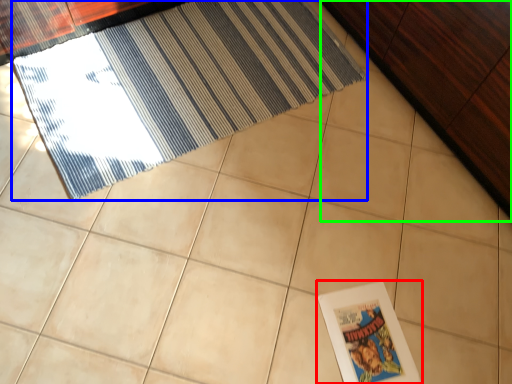
Question: Based on their relative distances, which object is nearer to picture frame (highlighted by a red box)? Choose from door (highlighted by a blue box) and dresser (highlighted by a green box).

Choices:
 (A) door
 (B) dresser

Answer: (B)